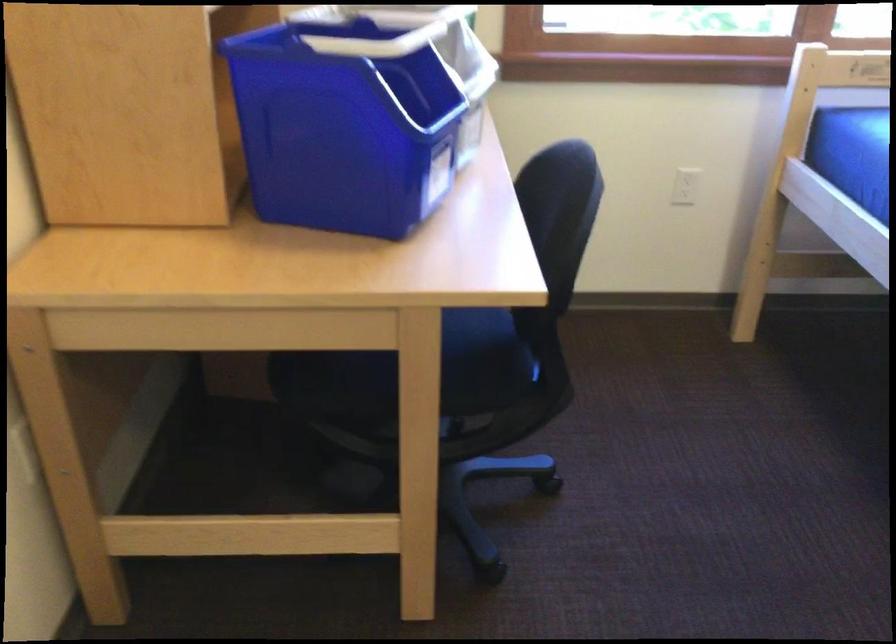
Where would you plugging in the electrical outlet socket? Please return your answer as a coordinate pair (x, y).

(683, 187)